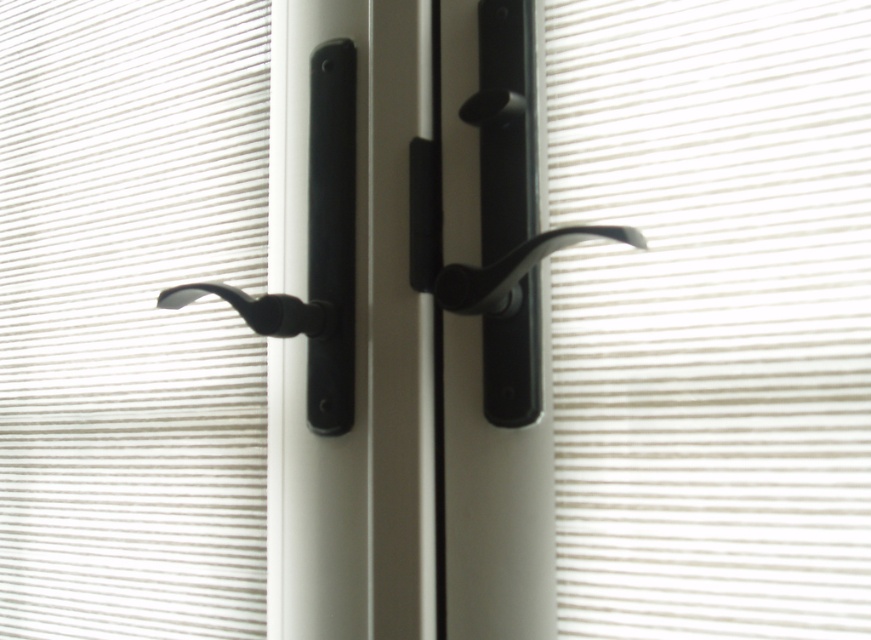
Question: Does white matte blind at center appear on the left side of white matte blind at left?

Choices:
 (A) yes
 (B) no

Answer: (B)

Question: Which object appears closest to the camera in this image?

Choices:
 (A) white matte blind at center
 (B) matte black lever at center
 (C) white matte blind at left

Answer: (A)

Question: Does white matte blind at center come in front of white matte blind at left?

Choices:
 (A) no
 (B) yes

Answer: (B)

Question: Estimate the real-world distances between objects in this image. Which object is farther from the black matte door handle at center?

Choices:
 (A) white matte blind at left
 (B) white matte blind at center

Answer: (A)

Question: Is white matte blind at center smaller than white matte blind at left?

Choices:
 (A) yes
 (B) no

Answer: (A)

Question: Which of the following is the farthest from the observer?

Choices:
 (A) black matte door handle at center
 (B) white matte blind at center
 (C) matte black lever at center
 (D) white matte blind at left

Answer: (D)